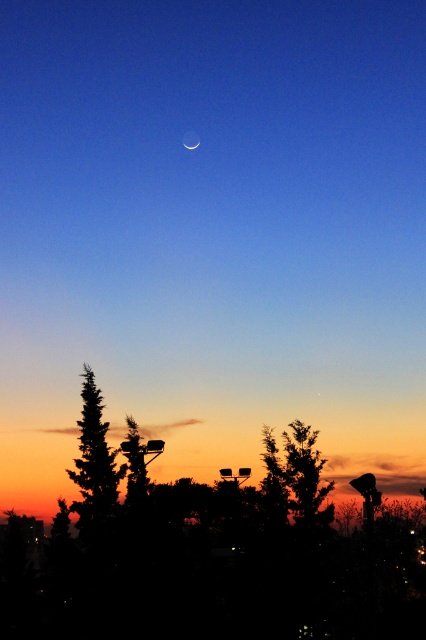
Can you confirm if green leafy tree at lower right is bigger than matte white crescent at upper center?

Indeed, green leafy tree at lower right has a larger size compared to matte white crescent at upper center.

Between point (308, 456) and point (198, 145), which one is positioned in front?

Point (308, 456)

Between point (298, 502) and point (192, 141), which one is positioned behind?

The point (192, 141) is more distant.

Where is `green leafy tree at lower right`? The width and height of the screenshot is (426, 640). green leafy tree at lower right is located at coordinates (296, 476).

Which is behind, point (126, 499) or point (184, 141)?

Point (184, 141)

Between green leafy tree at lower left and matte white crescent at upper center, which one has less height?

Standing shorter between the two is matte white crescent at upper center.

The width and height of the screenshot is (426, 640). What do you see at coordinates (138, 461) in the screenshot?
I see `green leafy tree at lower left` at bounding box center [138, 461].

At what (x,y) coordinates should I click in order to perform the action: click on green leafy tree at lower left. Please return your answer as a coordinate pair (x, y). Looking at the image, I should click on (138, 461).

Who is shorter, silhouette tree at lower left or green leafy tree at lower right?

silhouette tree at lower left

Where is `silhouette tree at lower left`? This screenshot has width=426, height=640. silhouette tree at lower left is located at coordinates (94, 467).